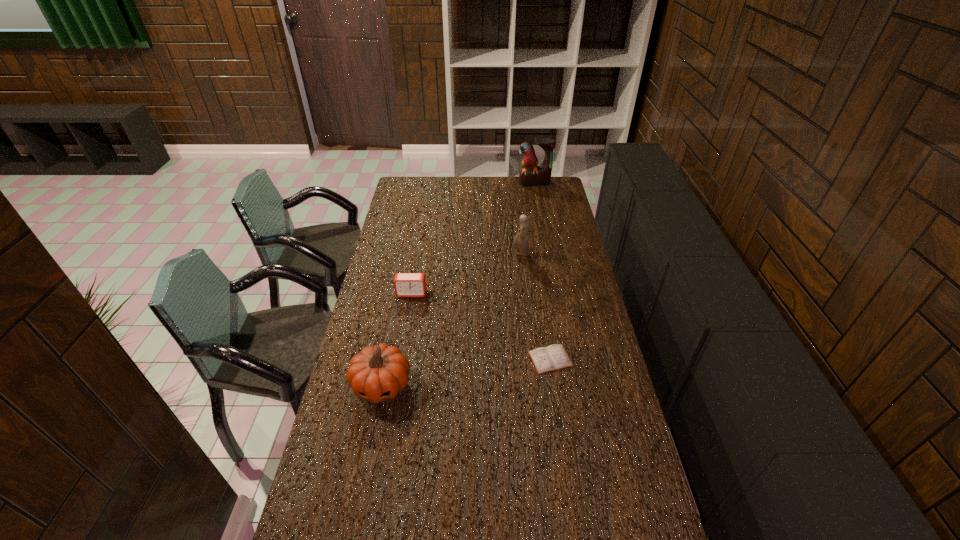
Image resolution: width=960 pixels, height=540 pixels. Identify the location of unoccupied area between the shortest object and the figurine. (536, 306).

What are the coordinates of `vacant area that lies between the shortest object and the pumpkin` in the screenshot? It's located at (467, 372).

The width and height of the screenshot is (960, 540). Identify the location of free space between the third shortest object and the shortest object. (467, 372).

This screenshot has width=960, height=540. In order to click on free space between the diary and the parrot in this screenshot , I will do (x=542, y=271).

Where is `vacant region between the third farthest object and the diary`? The width and height of the screenshot is (960, 540). vacant region between the third farthest object and the diary is located at coordinates pos(481,326).

Locate which object ranks fourth in proximity to the third tallest object. Please provide its 2D coordinates. Your answer should be formatted as a tuple, i.e. [(x, y)], where the tuple contains the x and y coordinates of a point satisfying the conditions above.

[(531, 175)]

Where is `object identified as the second closest to the third shortest object`? object identified as the second closest to the third shortest object is located at coordinates (553, 357).

Locate an element on the screen. This screenshot has height=540, width=960. vacant space that satisfies the following two spatial constraints: 1. at the face of the farthest object; 2. on the front-facing side of the second farthest object is located at coordinates (548, 253).

Find the location of a particular element. blank space that satisfies the following two spatial constraints: 1. on the front-facing side of the fourth shortest object; 2. on the front-facing side of the second shortest object is located at coordinates (524, 293).

You are a GUI agent. You are given a task and a screenshot of the screen. Output one action in this format:
    pyautogui.click(x=<x>, y=<y>)
    Task: Click on the free spot that satisfies the following two spatial constraints: 1. on the front-facing side of the diary; 2. on the left side of the alarm clock
    The width and height of the screenshot is (960, 540).
    Given the screenshot: What is the action you would take?
    pyautogui.click(x=400, y=359)